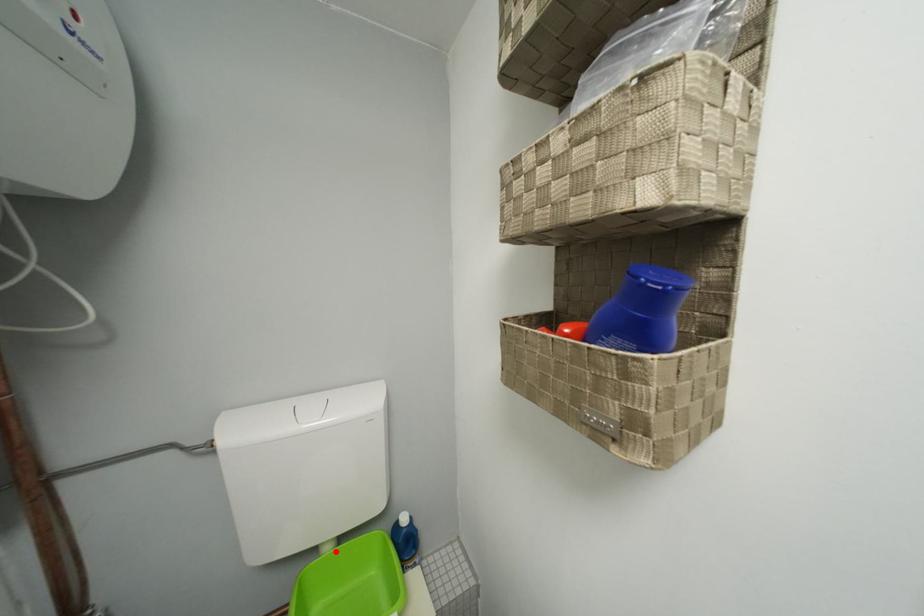
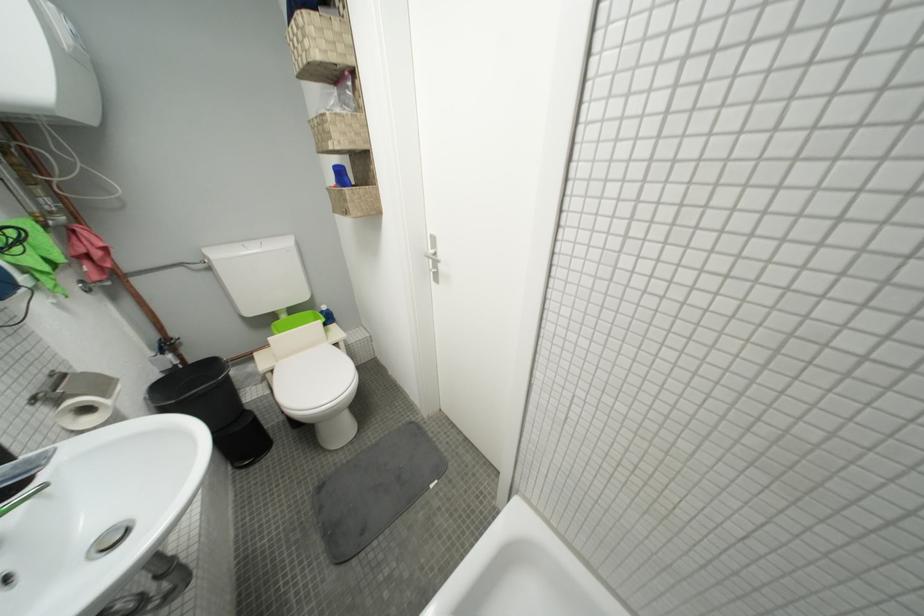
Question: I am providing you with two images of the same scene from different viewpoints. Given a red point in image1, look at the same physical point in image2. Is it:

Choices:
 (A) Closer to the viewpoint
 (B) Farther from the viewpoint

Answer: (A)